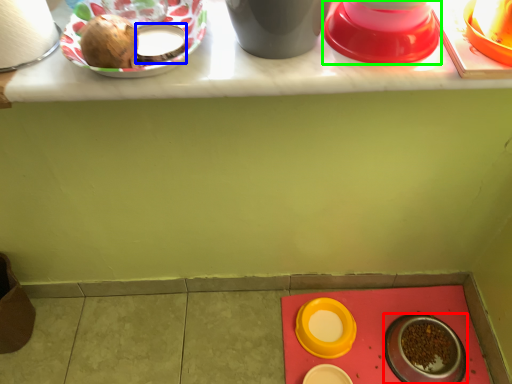
Question: Estimate the real-world distances between objects in this image. Which object is closer to tableware (highlighted by a red box), tableware (highlighted by a blue box) or tableware (highlighted by a green box)?

Choices:
 (A) tableware
 (B) tableware

Answer: (B)